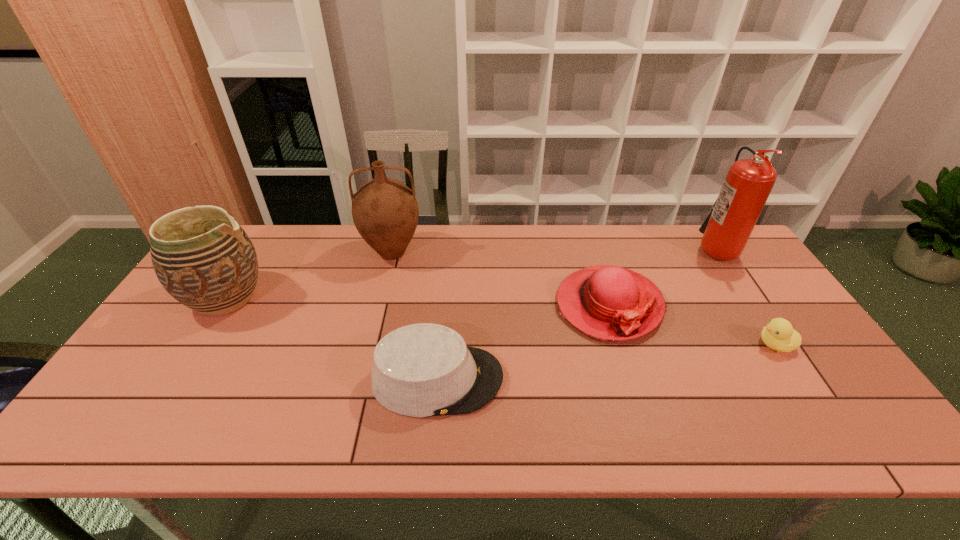
Identify the location of vacant space that's between the duckling and the fire extinguisher. (745, 295).

At what (x,y) coordinates should I click in order to perform the action: click on vacant area that lies between the pottery and the tallest object. Please return your answer as a coordinate pair (x, y). The image size is (960, 540). Looking at the image, I should click on (470, 272).

Find the location of a particular element. vacant area that lies between the shortest object and the tallest object is located at coordinates (745, 295).

Find the location of a particular element. Image resolution: width=960 pixels, height=540 pixels. vacant space that's between the duckling and the left hat is located at coordinates (607, 362).

Find the location of a particular element. This screenshot has width=960, height=540. free space between the fire extinguisher and the third object from right to left is located at coordinates (661, 276).

I want to click on blank region between the leftmost object and the right hat, so click(x=418, y=301).

Where is `the closest object to the left hat`? The width and height of the screenshot is (960, 540). the closest object to the left hat is located at coordinates (608, 302).

Identify which object is located as the fourth nearest to the left hat. Please provide its 2D coordinates. Your answer should be formatted as a tuple, i.e. [(x, y)], where the tuple contains the x and y coordinates of a point satisfying the conditions above.

[(779, 335)]

Image resolution: width=960 pixels, height=540 pixels. Find the location of `vacant space that satisfies the following two spatial constraints: 1. at the front of the third object from right to left with a bow; 2. on the front-facing side of the left hat`. vacant space that satisfies the following two spatial constraints: 1. at the front of the third object from right to left with a bow; 2. on the front-facing side of the left hat is located at coordinates (632, 379).